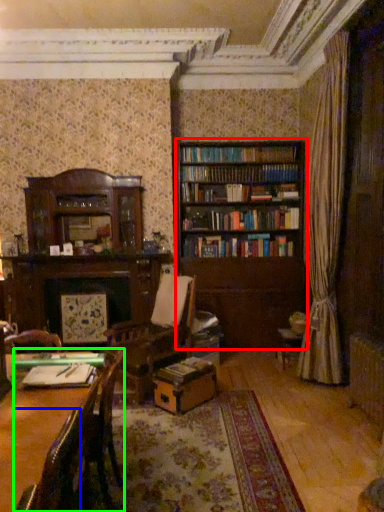
Question: Which is nearer to the bookcase (highlighted by a red box)? chair (highlighted by a blue box) or chair (highlighted by a green box).

Choices:
 (A) chair
 (B) chair

Answer: (B)